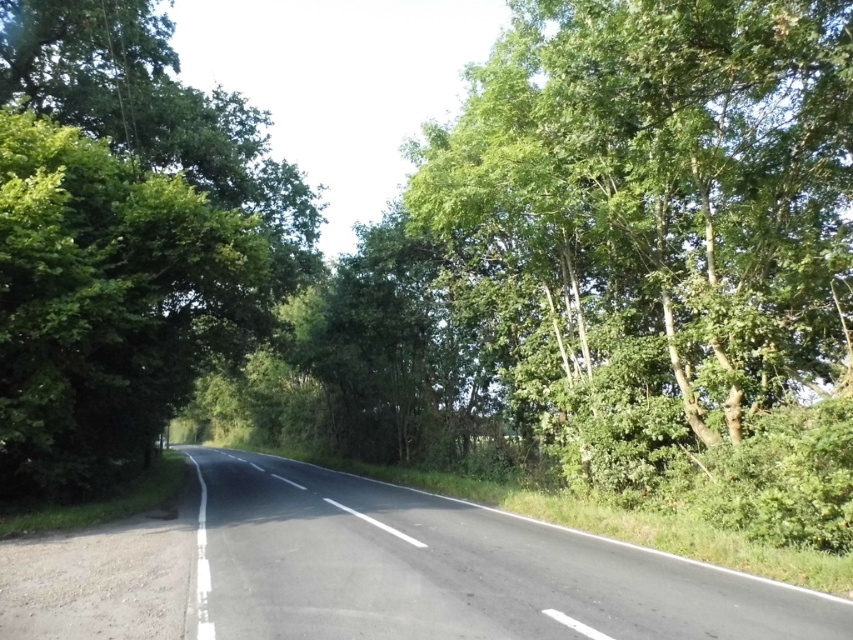
Question: Is green leafy tree at right above black asphalt road at center?

Choices:
 (A) yes
 (B) no

Answer: (A)

Question: Is green leafy tree at right to the right of green leafy tree at left from the viewer's perspective?

Choices:
 (A) no
 (B) yes

Answer: (B)

Question: Does green leafy tree at right appear under green leafy tree at left?

Choices:
 (A) yes
 (B) no

Answer: (B)

Question: Which object appears closest to the camera in this image?

Choices:
 (A) black asphalt road at center
 (B) green leafy tree at left

Answer: (A)

Question: Among these points, which one is farthest from the camera?

Choices:
 (A) (793, 200)
 (B) (776, 632)
 (C) (140, 358)

Answer: (C)

Question: Which object is the closest to the green leafy tree at left?

Choices:
 (A) black asphalt road at center
 (B) green leafy tree at right

Answer: (A)